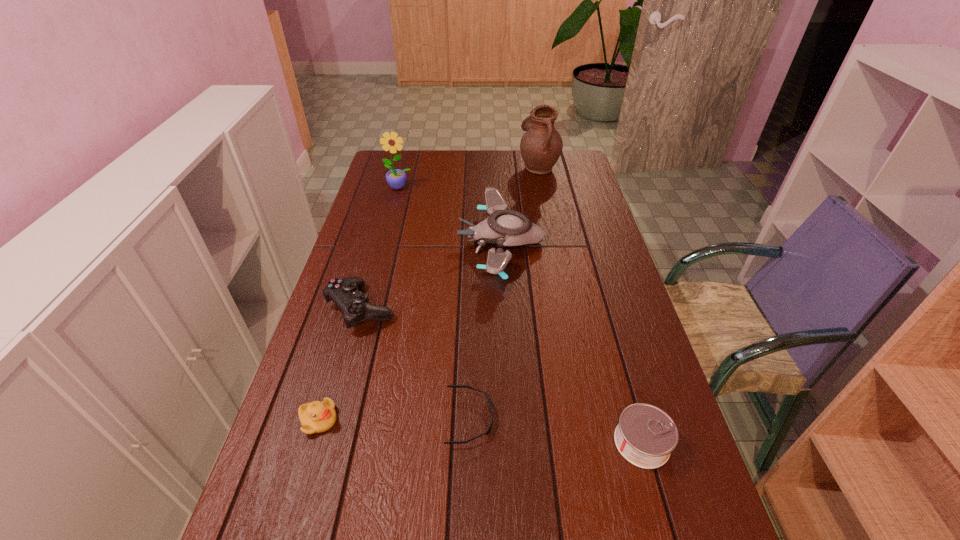
At what (x,y) coordinates should I click in order to perform the action: click on vacant space that is in between the sunglasses and the control. Please return your answer as a coordinate pair (x, y). The image size is (960, 540). Looking at the image, I should click on (416, 363).

You are a GUI agent. You are given a task and a screenshot of the screen. Output one action in this format:
    pyautogui.click(x=<x>, y=<y>)
    Task: Click on the vacant region between the drone and the shortest object
    Image resolution: width=960 pixels, height=540 pixels.
    Given the screenshot: What is the action you would take?
    pyautogui.click(x=486, y=330)

You are a GUI agent. You are given a task and a screenshot of the screen. Output one action in this format:
    pyautogui.click(x=<x>, y=<y>)
    Task: Click on the unoccupied position between the pitcher and the shortest object
    The height and width of the screenshot is (540, 960).
    Given the screenshot: What is the action you would take?
    pyautogui.click(x=504, y=292)

At what (x,y) coordinates should I click in order to perform the action: click on free spot between the second farthest object and the shortest object. Please return your answer as a coordinate pair (x, y). Looking at the image, I should click on (435, 302).

Where is `empty space that is in between the sixth nearest object and the can`? The height and width of the screenshot is (540, 960). empty space that is in between the sixth nearest object and the can is located at coordinates [520, 315].

Identify the location of free space between the sunflower and the drone. Image resolution: width=960 pixels, height=540 pixels. (450, 215).

Image resolution: width=960 pixels, height=540 pixels. What are the coordinates of `empty space between the duckling and the drone` in the screenshot? It's located at (410, 332).

The image size is (960, 540). I want to click on vacant area that lies between the duckling and the sunglasses, so click(x=395, y=419).

Identify which object is the fifth closest to the can. Please provide its 2D coordinates. Your answer should be formatted as a tuple, i.e. [(x, y)], where the tuple contains the x and y coordinates of a point satisfying the conditions above.

[(541, 145)]

Identify which object is located as the second nearest to the control. Please provide its 2D coordinates. Your answer should be formatted as a tuple, i.e. [(x, y)], where the tuple contains the x and y coordinates of a point satisfying the conditions above.

[(315, 417)]